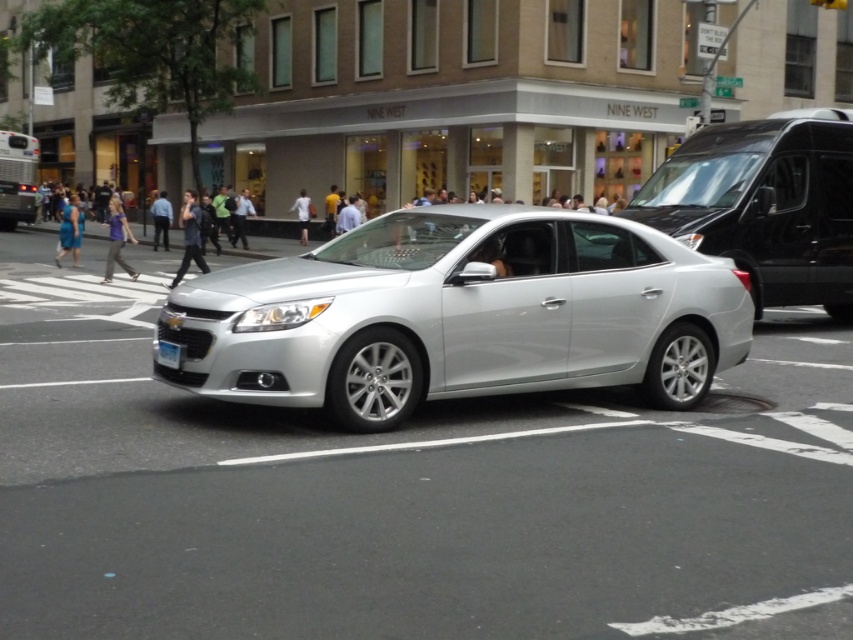
Question: Which object is positioned farthest from the white plastic license plate at center?

Choices:
 (A) shiny black van at center right
 (B) silver metallic sedan at center

Answer: (A)

Question: Which point is farther to the camera?

Choices:
 (A) pyautogui.click(x=842, y=141)
 (B) pyautogui.click(x=177, y=364)

Answer: (A)

Question: Which point is farther to the camera?

Choices:
 (A) (842, 282)
 (B) (200, 384)

Answer: (A)

Question: Can you confirm if silver metallic sedan at center is wider than white plastic license plate at center?

Choices:
 (A) no
 (B) yes

Answer: (B)

Question: Does shiny black van at center right have a larger size compared to white plastic license plate at center?

Choices:
 (A) no
 (B) yes

Answer: (B)

Question: Is silver metallic sedan at center to the right of white plastic license plate at center from the viewer's perspective?

Choices:
 (A) no
 (B) yes

Answer: (B)